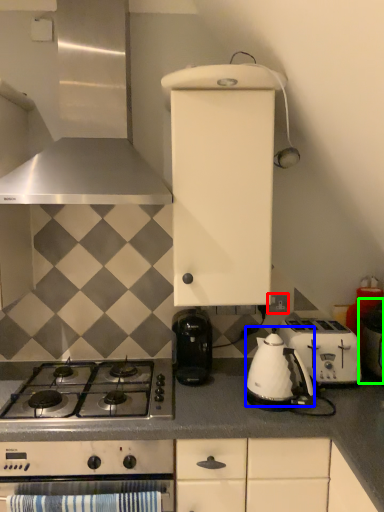
Question: Which object is positioned closest to electric outlet (highlighted by a red box)? Select from tea pot (highlighted by a blue box) and appliance (highlighted by a green box).

Choices:
 (A) tea pot
 (B) appliance

Answer: (B)